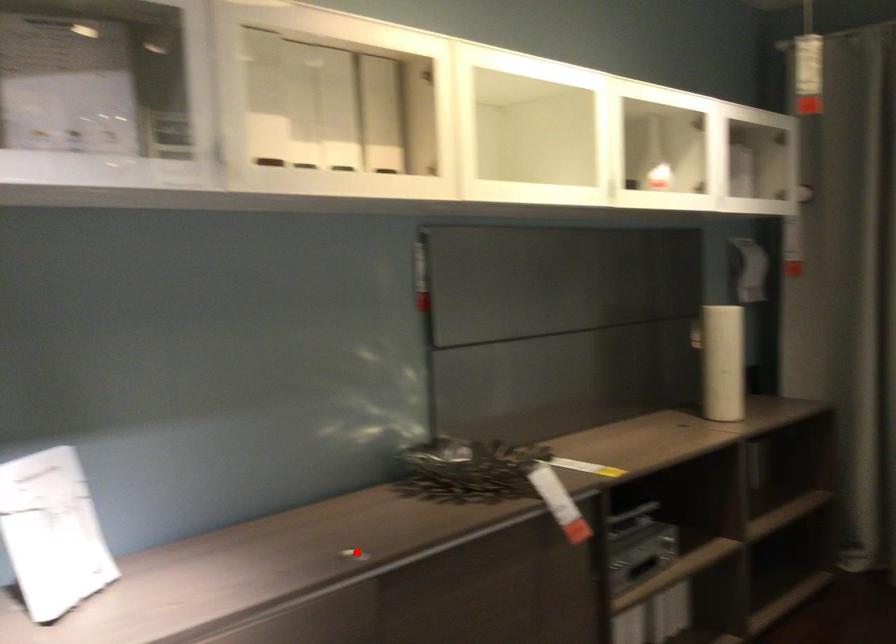
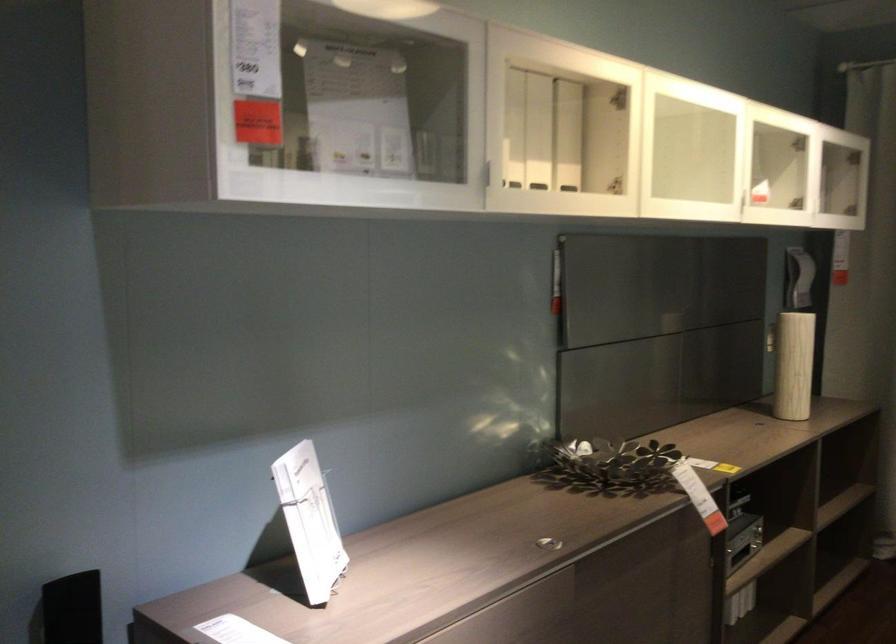
Locate, in the second image, the point that corresponds to the highlighted location in the first image.

(547, 543)